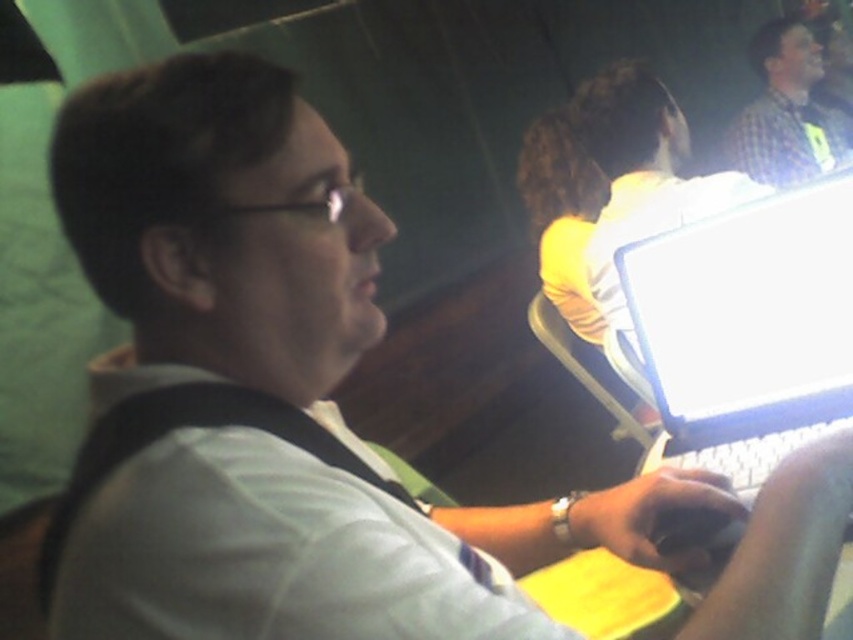
Question: Can you confirm if white glossy laptop at center is positioned below checkered shirt at upper right?

Choices:
 (A) yes
 (B) no

Answer: (A)

Question: Which of the following is the farthest from the observer?

Choices:
 (A) checkered shirt at upper right
 (B) white glossy laptop at center

Answer: (A)

Question: Does white glossy laptop at center come in front of checkered shirt at upper right?

Choices:
 (A) no
 (B) yes

Answer: (B)

Question: Is white glossy laptop at center smaller than checkered shirt at upper right?

Choices:
 (A) no
 (B) yes

Answer: (B)

Question: Which point is closer to the camera?

Choices:
 (A) pos(762,29)
 (B) pos(782,300)

Answer: (B)